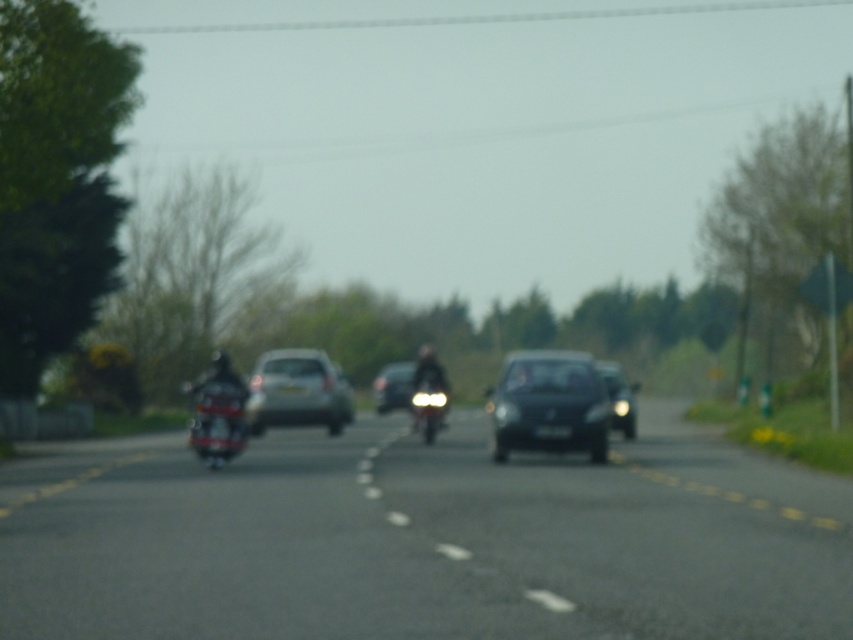
Does black glossy van at center have a smaller size compared to shiny chrome motorcycle at center?

Actually, black glossy van at center might be larger than shiny chrome motorcycle at center.

Which is more to the right, black glossy van at center or shiny chrome motorcycle at center?

Positioned to the right is black glossy van at center.

Which is behind, point (611, 417) or point (413, 404)?

The point (413, 404) is behind.

Find the location of a particular element. black glossy van at center is located at coordinates (619, 397).

Does silver metallic hatchback at center appear over shiny chrome motorcycle at center?

Yes, silver metallic hatchback at center is above shiny chrome motorcycle at center.

Is silver metallic hatchback at center to the right of shiny chrome motorcycle at center from the viewer's perspective?

Incorrect, silver metallic hatchback at center is not on the right side of shiny chrome motorcycle at center.

You are a GUI agent. You are given a task and a screenshot of the screen. Output one action in this format:
    pyautogui.click(x=<x>, y=<y>)
    Task: Click on the silver metallic hatchback at center
    The width and height of the screenshot is (853, 640).
    Given the screenshot: What is the action you would take?
    pyautogui.click(x=296, y=392)

Where is `silver metallic hatchback at center`? This screenshot has width=853, height=640. silver metallic hatchback at center is located at coordinates (296, 392).

Is black asphalt road at center above shiny chrome motorcycle at center?

Actually, black asphalt road at center is below shiny chrome motorcycle at center.

Between black asphalt road at center and shiny chrome motorcycle at center, which one has less height?

With less height is black asphalt road at center.

Which is behind, point (323, 493) or point (439, 392)?

Point (439, 392)

The image size is (853, 640). What are the coordinates of `black asphalt road at center` in the screenshot? It's located at (436, 541).